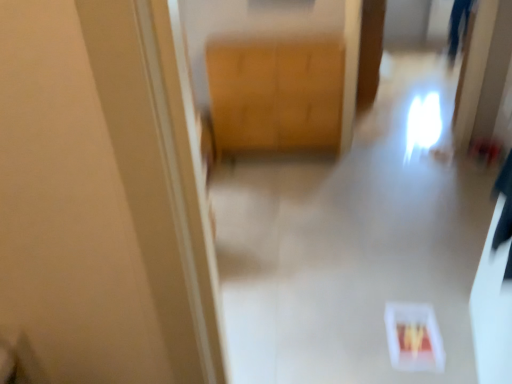
Where is `white plastic container at lower center`? The width and height of the screenshot is (512, 384). white plastic container at lower center is located at coordinates (354, 243).

This screenshot has height=384, width=512. What do you see at coordinates (354, 243) in the screenshot? I see `white plastic container at lower center` at bounding box center [354, 243].

Describe the element at coordinates (276, 94) in the screenshot. I see `wooden cabinet at center` at that location.

Where is `wooden cabinet at center`? The image size is (512, 384). wooden cabinet at center is located at coordinates (276, 94).

Locate an element on the screen. The height and width of the screenshot is (384, 512). white plastic container at lower center is located at coordinates (354, 243).

Which is more to the left, wooden cabinet at center or white plastic container at lower center?

wooden cabinet at center.

Between wooden cabinet at center and white plastic container at lower center, which one is positioned in front?

white plastic container at lower center.

Does point (237, 88) come in front of point (332, 271)?

No, it is behind (332, 271).

From the image's perspective, between wooden cabinet at center and white plastic container at lower center, who is located below?

white plastic container at lower center is shown below in the image.

From a real-world perspective, is wooden cabinet at center physically above white plastic container at lower center?

Yes, from a real-world perspective, wooden cabinet at center is on top of white plastic container at lower center.

Is wooden cabinet at center wider than white plastic container at lower center?

No, wooden cabinet at center is not wider than white plastic container at lower center.

Can you confirm if wooden cabinet at center is shorter than white plastic container at lower center?

No.

Can you confirm if wooden cabinet at center is bigger than white plastic container at lower center?

No, wooden cabinet at center is not bigger than white plastic container at lower center.

Is white plastic container at lower center located within wooden cabinet at center?

No, white plastic container at lower center is not inside wooden cabinet at center.

Would you say wooden cabinet at center is a long distance from white plastic container at lower center?

wooden cabinet at center is actually quite close to white plastic container at lower center.

In the scene shown: Could you tell me if wooden cabinet at center is facing white plastic container at lower center?

Yes, wooden cabinet at center is oriented towards white plastic container at lower center.

How different are the orientations of wooden cabinet at center and white plastic container at lower center in degrees?

0.682 degrees separate the facing orientations of wooden cabinet at center and white plastic container at lower center.

How far apart are wooden cabinet at center and white plastic container at lower center?

The distance of wooden cabinet at center from white plastic container at lower center is 26.82 inches.

Where is `path on the right of wooden cabinet at center`? The image size is (512, 384). path on the right of wooden cabinet at center is located at coordinates (354, 243).

Is white plastic container at lower center at the right side of wooden cabinet at center?

Yes.

From the picture: Which is behind, white plastic container at lower center or wooden cabinet at center?

wooden cabinet at center.

Between point (315, 348) and point (269, 148), which one is positioned behind?

The point (269, 148) is behind.

Looking at this image, from the image's perspective, is white plastic container at lower center above wooden cabinet at center?

No, from the image's perspective, white plastic container at lower center is not above wooden cabinet at center.

In the scene shown: From a real-world perspective, who is located higher, white plastic container at lower center or wooden cabinet at center?

wooden cabinet at center.

Can you confirm if white plastic container at lower center is wider than wooden cabinet at center?

Correct, the width of white plastic container at lower center exceeds that of wooden cabinet at center.

From their relative heights in the image, would you say white plastic container at lower center is taller or shorter than wooden cabinet at center?

Result: Clearly, white plastic container at lower center is shorter compared to wooden cabinet at center.

Who is smaller, white plastic container at lower center or wooden cabinet at center?

wooden cabinet at center is smaller.

Can we say white plastic container at lower center lies outside wooden cabinet at center?

Yes, white plastic container at lower center is not within wooden cabinet at center.

Are white plastic container at lower center and wooden cabinet at center far apart?

white plastic container at lower center is near wooden cabinet at center, not far away.

Is white plastic container at lower center looking in the opposite direction of wooden cabinet at center?

That's not correct — white plastic container at lower center is not looking away from wooden cabinet at center.

Locate an element on the screen. path located underneath the wooden cabinet at center (from a real-world perspective) is located at coordinates (354, 243).

Where is `cabinetry lying above the white plastic container at lower center (from the image's perspective)`? cabinetry lying above the white plastic container at lower center (from the image's perspective) is located at coordinates (276, 94).

Where is `path below the wooden cabinet at center (from a real-world perspective)`? path below the wooden cabinet at center (from a real-world perspective) is located at coordinates (x=354, y=243).